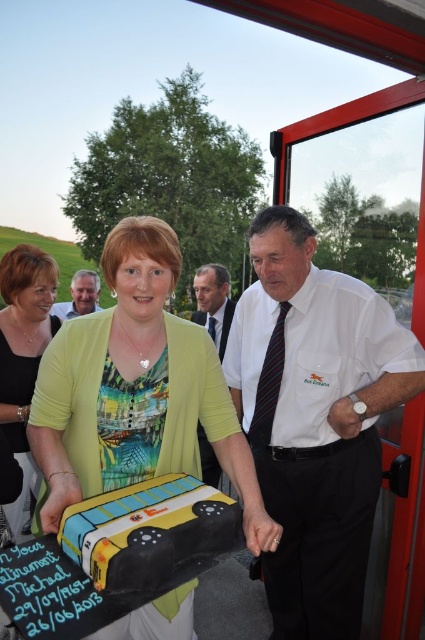
Question: Among these objects, which one is nearest to the camera?

Choices:
 (A) matte black suit at center
 (B) white striped tie at center
 (C) light brown tie at center

Answer: (B)

Question: Is white striped tie at center wider than light brown tie at center?

Choices:
 (A) yes
 (B) no

Answer: (A)

Question: Considering the real-world distances, which object is closest to the matte green blouse at center?

Choices:
 (A) light brown tie at center
 (B) matte black suit at center
 (C) yellow fondant bus at center

Answer: (A)

Question: Which object appears closest to the camera in this image?

Choices:
 (A) matte green blouse at center
 (B) matte yellow dress at center

Answer: (B)

Question: In this image, where is white striped tie at center located relative to matte yellow dress at center?

Choices:
 (A) left
 (B) right

Answer: (B)

Question: Does white striped tie at center have a lesser width compared to light brown tie at center?

Choices:
 (A) yes
 (B) no

Answer: (B)